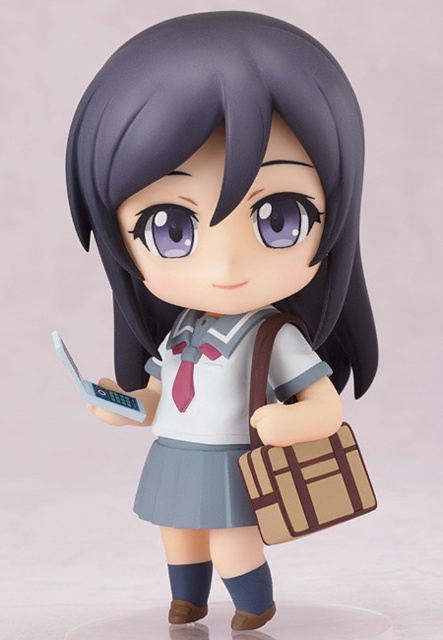
You are an interior designer arranging a display case. You have two items to place inside the case. The first is the matte plastic figure at center, and the second is the matte gray fabric school uniform at center. According to the image, which item should be placed on the left side of the display case?

The matte gray fabric school uniform at center should be placed on the left side of the display case because the matte plastic figure at center is to the right of it in the image.

Consider the image. What is the color of the fabric at the coordinates point (x=201, y=422)?

The point (x=201, y=422) corresponds to the matte gray fabric school uniform at center.

You are organizing a school supply store and need to place the matte plastic figure at center and the beige fabric briefcase at lower right on a shelf. If the shelf is only wide enough for one item, which item should you choose to place on the shelf first based on their positions in the image?

The matte plastic figure at center should be placed first because it is positioned to the left of the beige fabric briefcase at lower right, so it would be closer to the starting point of the shelf.